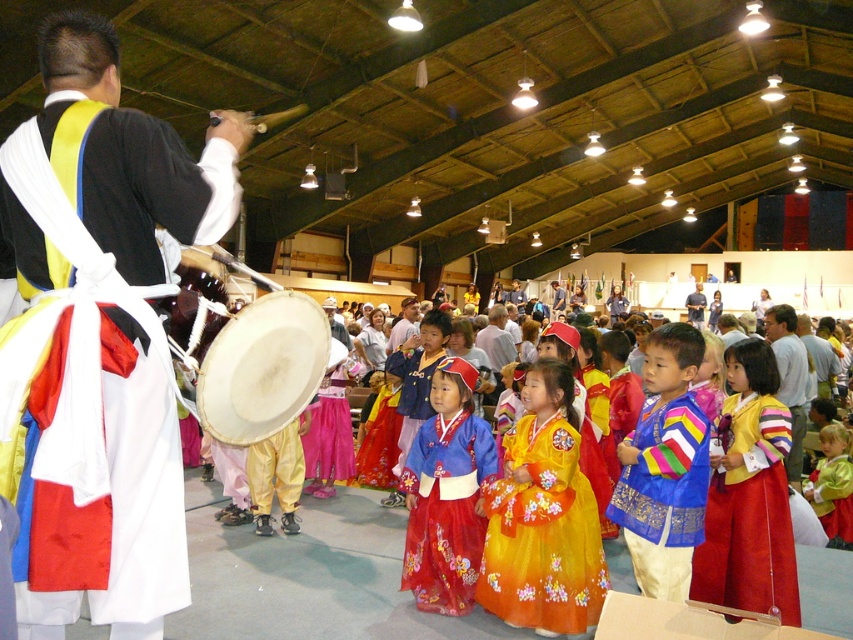
The image size is (853, 640). I want to click on blue satin blouse at center, so click(664, 467).

Can you confirm if blue satin blouse at center is shorter than striped sweater at center?

No, blue satin blouse at center is not shorter than striped sweater at center.

This screenshot has height=640, width=853. I want to click on blue satin blouse at center, so point(664,467).

Which of these two, silky satin robe at left or blue satin blouse at center, stands shorter?

blue satin blouse at center is shorter.

Who is more forward, (102, 392) or (701, 428)?

Point (102, 392) is more forward.

Locate an element on the screen. Image resolution: width=853 pixels, height=640 pixels. silky satin robe at left is located at coordinates (90, 424).

Does silky satin robe at left appear over silky pink skirt at center?

Yes, silky satin robe at left is above silky pink skirt at center.

Does silky satin robe at left have a lesser height compared to silky pink skirt at center?

Incorrect, silky satin robe at left's height does not fall short of silky pink skirt at center's.

Between point (144, 346) and point (343, 467), which one is positioned behind?

Point (343, 467)

The width and height of the screenshot is (853, 640). Identify the location of silky satin robe at left. (90, 424).